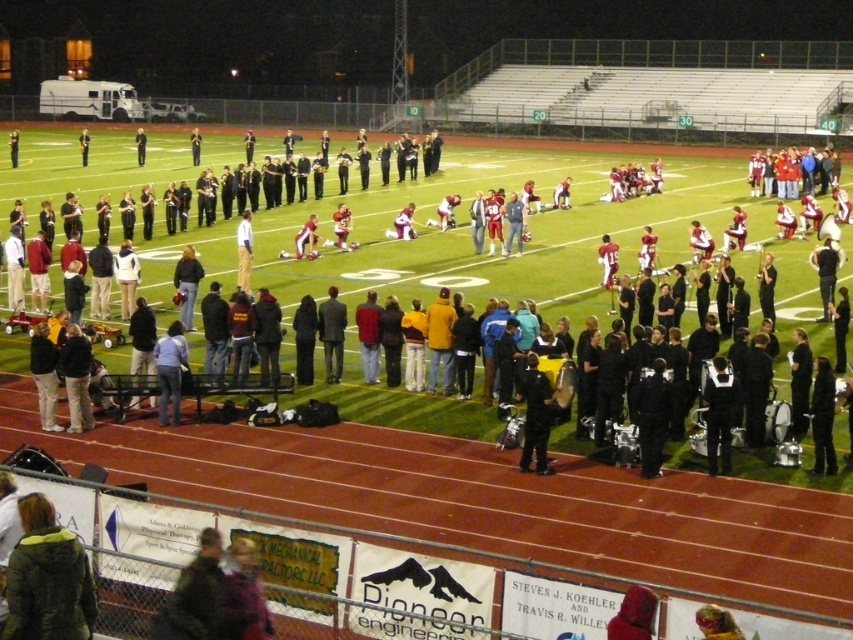
You are a photographer at the stadium and want to capture both the point at location (142, 141) and the point at (83, 152) in your photo. Which point will appear closer to the edge of the frame if the camera is positioned to focus on the closer object?

The point at (83, 152) is closer to the camera, so when focusing on it, the point at (142, 141) will appear farther away and thus closer to the edge of the frame.

You are a photographer trying to capture the halftime show. You want to position yourself so that the black uniform at center is in the center of your photo. What coordinates should you aim for?

The black uniform at center is located at coordinates 0.650 on the x axis and 0.628 on the y axis. To center it in your photo, aim for those coordinates.

You are a photographer standing at the edge of the football field. You notice two people in the center of the field wearing a black uniform at center and a light blue shirt at center. Which one do you think is taller?

The black uniform at center is much taller than the light blue shirt at center.